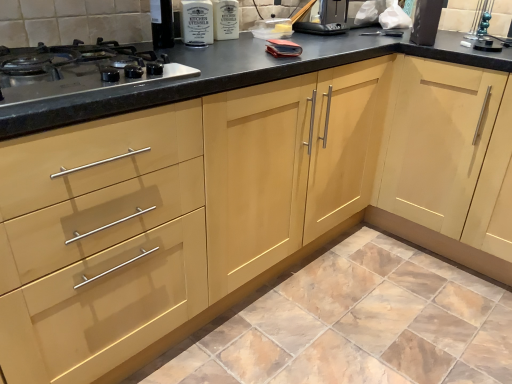
Question: Does matte ceramic tile at lower center appear on the left side of black plastic toaster at upper center, the 1th appliance viewed from the left?

Choices:
 (A) no
 (B) yes

Answer: (A)

Question: From a real-world perspective, is matte ceramic tile at lower center located higher than black plastic toaster at upper center, which appears as the 2th appliance when viewed from the right?

Choices:
 (A) yes
 (B) no

Answer: (B)

Question: Is matte ceramic tile at lower center positioned with its back to black plastic toaster at upper center, which appears as the 2th appliance when viewed from the right?

Choices:
 (A) no
 (B) yes

Answer: (A)

Question: Are matte ceramic tile at lower center and black plastic toaster at upper center, which appears as the 2th appliance when viewed from the right, far apart?

Choices:
 (A) yes
 (B) no

Answer: (A)

Question: Can we say matte ceramic tile at lower center lies outside black plastic toaster at upper center, which appears as the 2th appliance when viewed from the right?

Choices:
 (A) no
 (B) yes

Answer: (B)

Question: From the image's perspective, is black matte toaster at upper right, acting as the 2th appliance starting from the left, located above or below light wood cabinet at center?

Choices:
 (A) above
 (B) below

Answer: (A)

Question: Is point (431, 16) positioned closer to the camera than point (439, 201)?

Choices:
 (A) closer
 (B) farther

Answer: (A)

Question: Based on their sizes in the image, would you say black matte toaster at upper right, which is counted as the 2th appliance, starting from the back, is bigger or smaller than light wood cabinet at center?

Choices:
 (A) big
 (B) small

Answer: (B)

Question: Is black matte toaster at upper right, acting as the first appliance starting from the right, inside or outside of light wood cabinet at center?

Choices:
 (A) inside
 (B) outside

Answer: (B)

Question: From a real-world perspective, is matte ceramic tile at lower center positioned above or below black plastic toaster at upper center, the 1th appliance viewed from the left?

Choices:
 (A) above
 (B) below

Answer: (B)

Question: Considering the positions of matte ceramic tile at lower center and black plastic toaster at upper center, which appears as the 2th appliance when viewed from the right, in the image, is matte ceramic tile at lower center bigger or smaller than black plastic toaster at upper center, which appears as the 2th appliance when viewed from the right,?

Choices:
 (A) small
 (B) big

Answer: (B)

Question: Considering the positions of point (432, 364) and point (342, 13), is point (432, 364) closer or farther from the camera than point (342, 13)?

Choices:
 (A) farther
 (B) closer

Answer: (B)

Question: In terms of width, does matte ceramic tile at lower center look wider or thinner when compared to black plastic toaster at upper center, the 1th appliance viewed from the left?

Choices:
 (A) wide
 (B) thin

Answer: (A)

Question: Visually, is matte ceramic tile at lower center positioned to the left or to the right of light wood cabinet at center?

Choices:
 (A) left
 (B) right

Answer: (A)

Question: Is point (182, 342) positioned closer to the camera than point (456, 91)?

Choices:
 (A) farther
 (B) closer

Answer: (B)